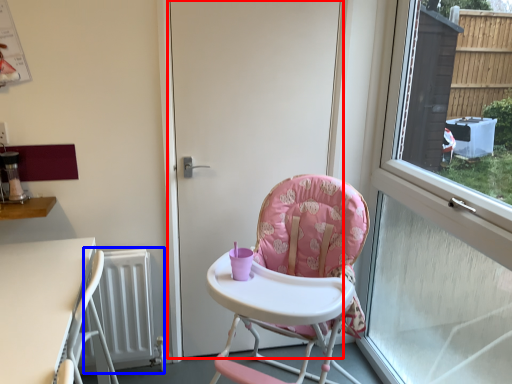
Question: Among these objects, which one is farthest to the camera, door (highlighted by a red box) or radiator (highlighted by a blue box)?

Choices:
 (A) door
 (B) radiator

Answer: (B)